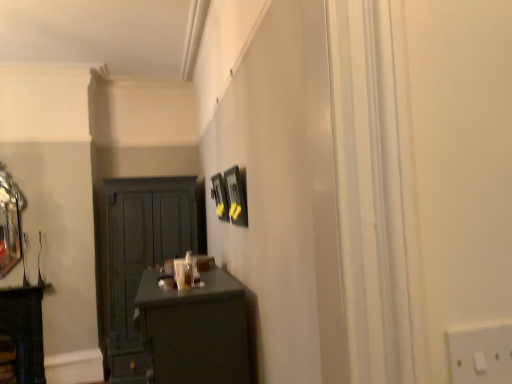
Question: Is matte dark wood cabinet at left to the left or to the right of matte black picture frame at center, which is the second picture frame from left to right, in the image?

Choices:
 (A) right
 (B) left

Answer: (B)

Question: In terms of width, does matte dark wood cabinet at left look wider or thinner when compared to matte black picture frame at center, which is the second picture frame from left to right?

Choices:
 (A) thin
 (B) wide

Answer: (B)

Question: Which of these objects is positioned farthest from the matte black picture frame at upper center, the second picture frame when ordered from right to left?

Choices:
 (A) matte dark green cupboard at left
 (B) matte dark wood cabinet at left
 (C) polished silver mirror at left
 (D) matte black desk at lower left
 (E) matte black picture frame at center, which ranks as the first picture frame in right-to-left order

Answer: (B)

Question: Which is nearer to the matte dark green cupboard at left?

Choices:
 (A) matte black desk at lower left
 (B) matte dark wood cabinet at left
 (C) matte black picture frame at center, which is the first picture frame in front-to-back order
 (D) polished silver mirror at left
 (E) matte black picture frame at upper center, acting as the first picture frame starting from the left

Answer: (B)